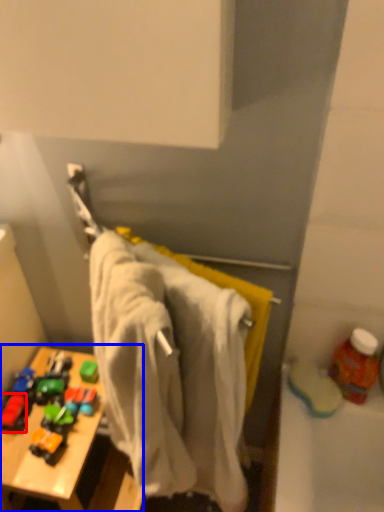
Question: Which object appears closest to the camera in this image, toy (highlighted by a red box) or table (highlighted by a blue box)?

Choices:
 (A) toy
 (B) table

Answer: (B)